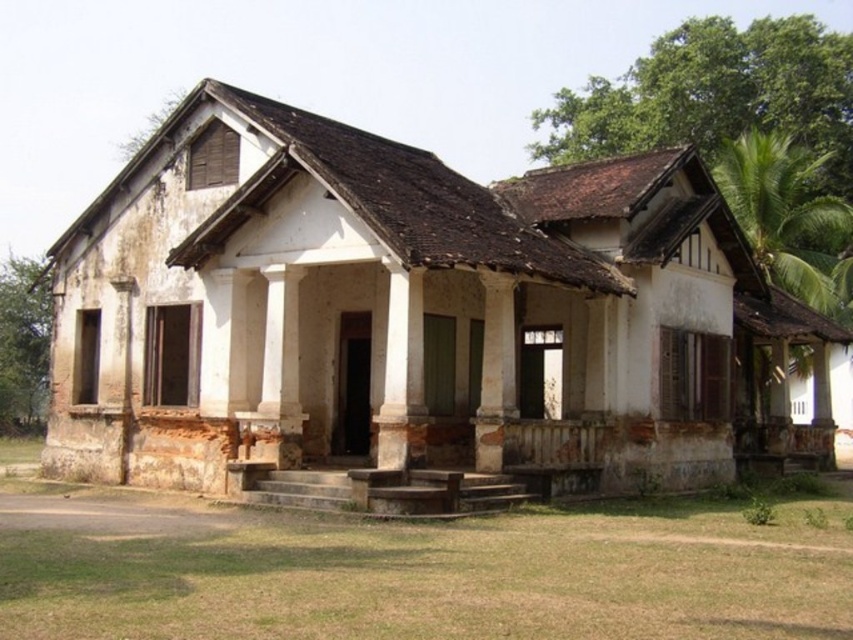
Who is higher up, white smooth pillar at center or brown weathered wood column at center?

white smooth pillar at center

Is point (397, 291) positioned after point (486, 307)?

No, (397, 291) is closer to viewer.

In the scene shown: Who is more distant from viewer, (401, 408) or (494, 413)?

The point (494, 413) is behind.

Where is `white smooth pillar at center`? This screenshot has width=853, height=640. white smooth pillar at center is located at coordinates (399, 369).